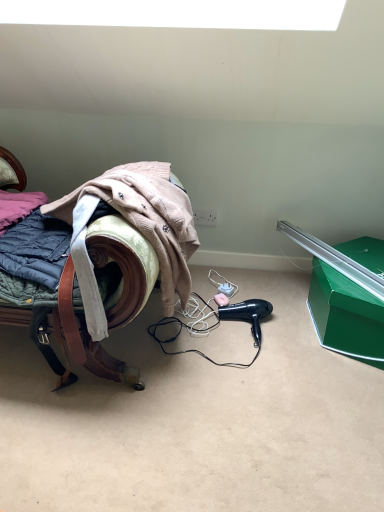
At what (x,y) coordinates should I click in order to perform the action: click on vacant point to the left of green cardboard box at lower right. Please return your answer as a coordinate pair (x, y). This screenshot has width=384, height=512. Looking at the image, I should click on (271, 311).